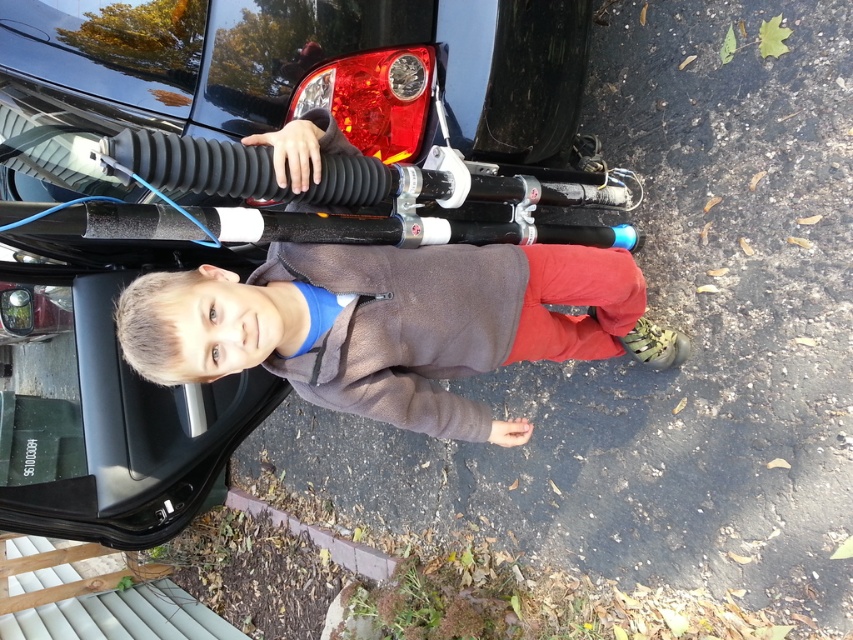
You are a delivery person trying to deliver a package to the address shown in the image. You need to leave the package near the brown fleece jacket at center and the black rubber tire at upper center. Which object should you place the package closer to if you want it to be more visible to the recipient?

The package should be placed closer to the black rubber tire at upper center because the brown fleece jacket at center is to the left of it, so the tire is more centrally located and visible in the scene.

You are standing at the center of the image. Which direction should you look to see the point at coordinates (x=276, y=72)?

The point at coordinates (x=276, y=72) is located on the glossy black car at upper left, so you should look towards the upper left direction to see it.